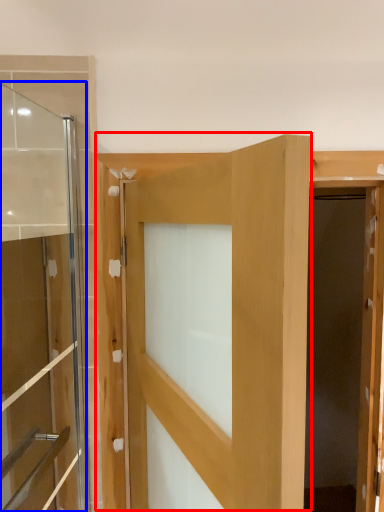
Question: Which object is closer to the camera taking this photo, door (highlighted by a red box) or door (highlighted by a blue box)?

Choices:
 (A) door
 (B) door

Answer: (A)